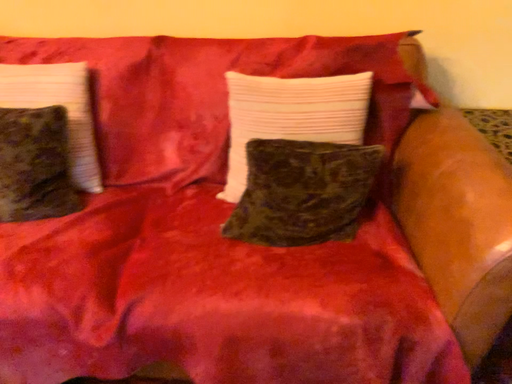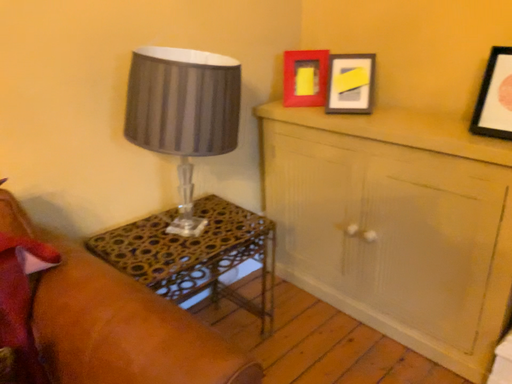
Question: How did the camera likely rotate when shooting the video?

Choices:
 (A) rotated downward
 (B) rotated upward

Answer: (B)